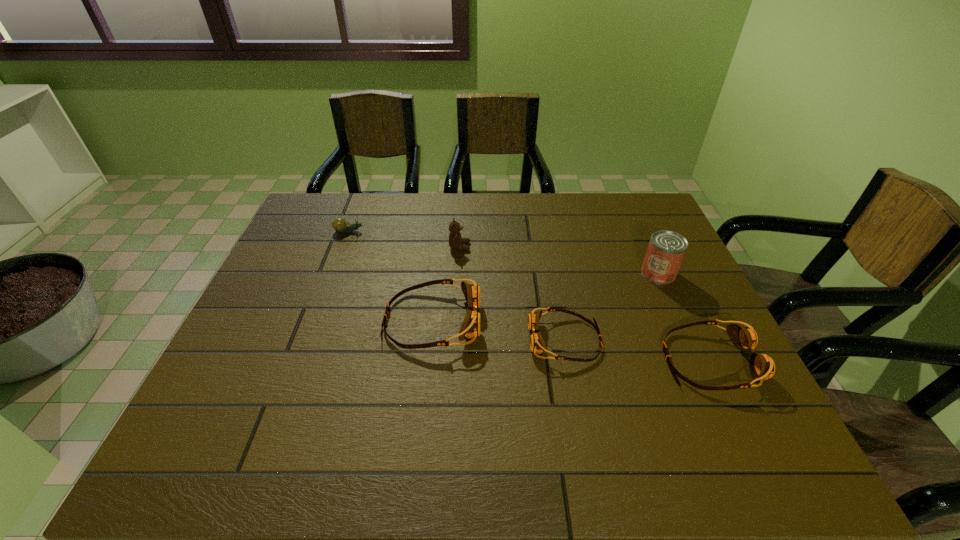
Identify the location of the leftmost goggles. The width and height of the screenshot is (960, 540). (470, 327).

Image resolution: width=960 pixels, height=540 pixels. I want to click on the second goggles from left to right, so click(x=537, y=345).

Locate an element on the screen. the shortest goggles is located at coordinates (537, 345).

The height and width of the screenshot is (540, 960). I want to click on the second tallest goggles, so click(762, 367).

Where is `the fourth tallest object`? This screenshot has width=960, height=540. the fourth tallest object is located at coordinates (762, 367).

I want to click on the farthest object, so click(x=340, y=225).

This screenshot has height=540, width=960. I want to click on the leftmost object, so click(x=340, y=225).

Where is `the fifth nearest object`? the fifth nearest object is located at coordinates (456, 241).

Locate an element on the screen. The height and width of the screenshot is (540, 960). the fifth shortest object is located at coordinates (456, 241).

Identify the location of the fourth nearest object. (666, 250).